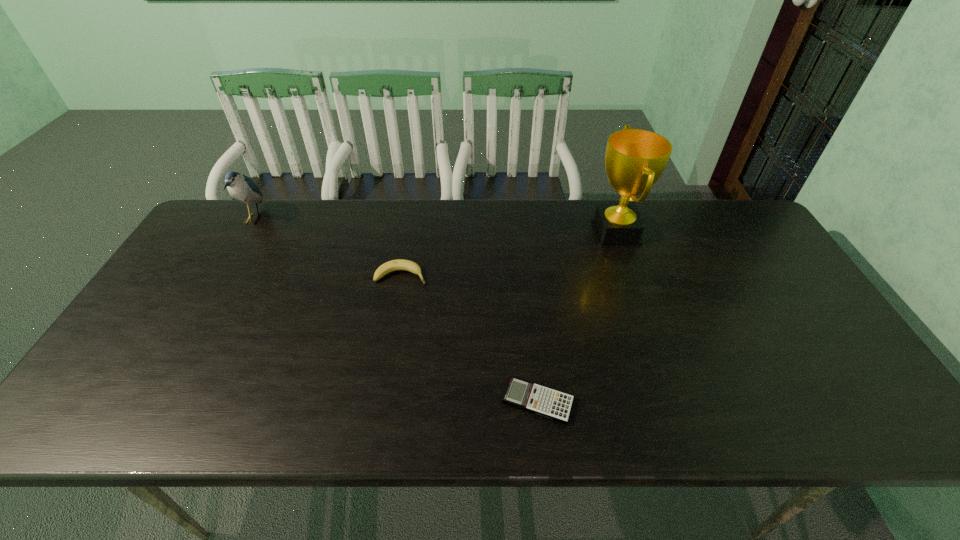
The width and height of the screenshot is (960, 540). I want to click on vacant space at the near edge, so click(x=799, y=407).

In the image, there is a desktop. Where is `vacant space at the right edge`? vacant space at the right edge is located at coordinates (789, 339).

Identify the location of vacant space at the near left corner of the desktop. (123, 397).

This screenshot has height=540, width=960. Identify the location of vacant area at the far right corner. (739, 218).

The image size is (960, 540). What are the coordinates of `vacant region between the calculator and the bird` in the screenshot? It's located at (396, 310).

The width and height of the screenshot is (960, 540). I want to click on free space that is in between the third object from left to right and the rightmost object, so click(577, 316).

Where is `empty space between the second shortest object and the nearest object`? This screenshot has height=540, width=960. empty space between the second shortest object and the nearest object is located at coordinates (469, 338).

The image size is (960, 540). Identify the location of vacant space in between the second object from left to right and the nearest object. (469, 338).

Locate an element on the screen. The image size is (960, 540). free space between the rightmost object and the banana is located at coordinates (509, 253).

This screenshot has width=960, height=540. In order to click on empty space that is in between the leftmost object and the third tallest object in this screenshot , I will do `click(327, 247)`.